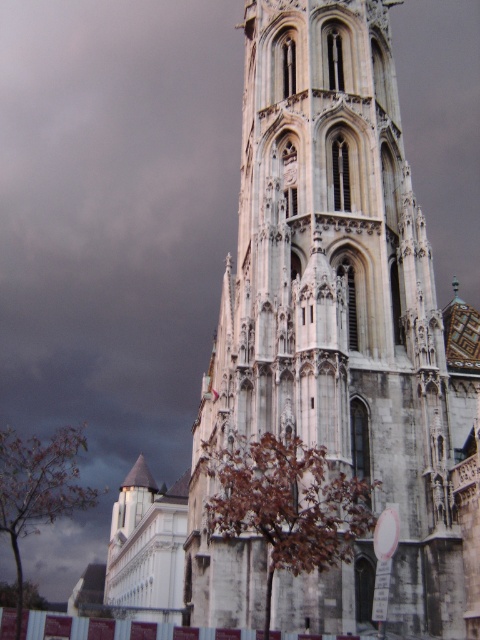
Can you confirm if white stone tower at center is wider than brown leafy tree at lower left?

No.

Where is `white stone tower at center`? white stone tower at center is located at coordinates (332, 310).

Can you confirm if white stone tower at center is taller than brown leafy tree at lower center?

Correct, white stone tower at center is much taller as brown leafy tree at lower center.

Does white stone tower at center have a greater width compared to brown leafy tree at lower center?

Yes.

You are a GUI agent. You are given a task and a screenshot of the screen. Output one action in this format:
    pyautogui.click(x=<x>, y=<y>)
    Task: Click on the white stone tower at center
    Image resolution: width=480 pixels, height=640 pixels.
    Given the screenshot: What is the action you would take?
    pyautogui.click(x=332, y=310)

Locate an element on the screen. The image size is (480, 640). brown leafy tree at lower center is located at coordinates (286, 502).

Is point (262, 520) more distant than point (22, 509)?

No, (262, 520) is closer to viewer.

Identify the location of brown leafy tree at lower center. Image resolution: width=480 pixels, height=640 pixels. (286, 502).